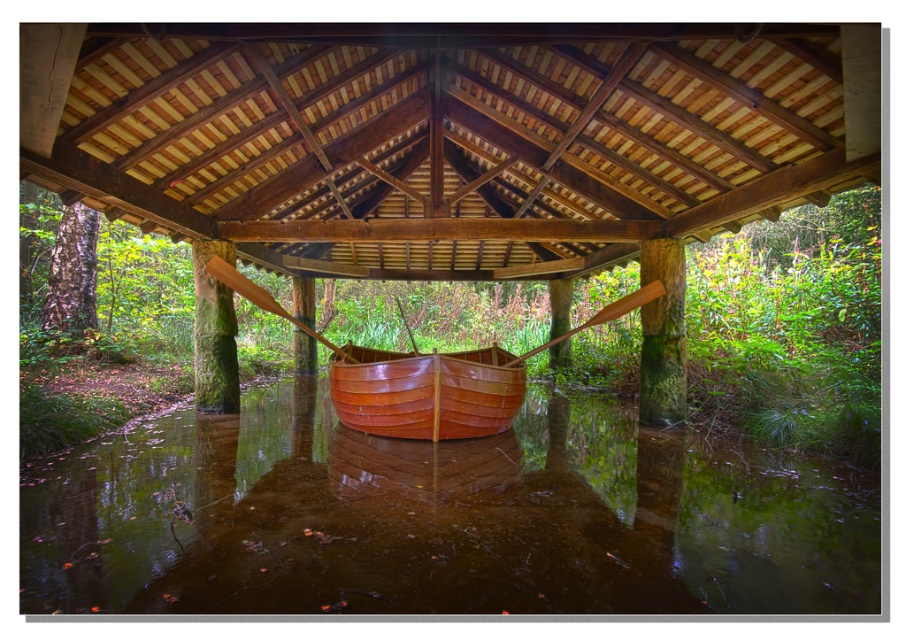
Which is behind, point (631, 422) or point (497, 381)?

The point (631, 422) is behind.

Is glossy wooden boat at center above shiny brown canoe at center?

Incorrect, glossy wooden boat at center is not positioned above shiny brown canoe at center.

Image resolution: width=906 pixels, height=640 pixels. What do you see at coordinates (440, 518) in the screenshot?
I see `glossy wooden boat at center` at bounding box center [440, 518].

The height and width of the screenshot is (640, 906). I want to click on glossy wooden boat at center, so click(x=440, y=518).